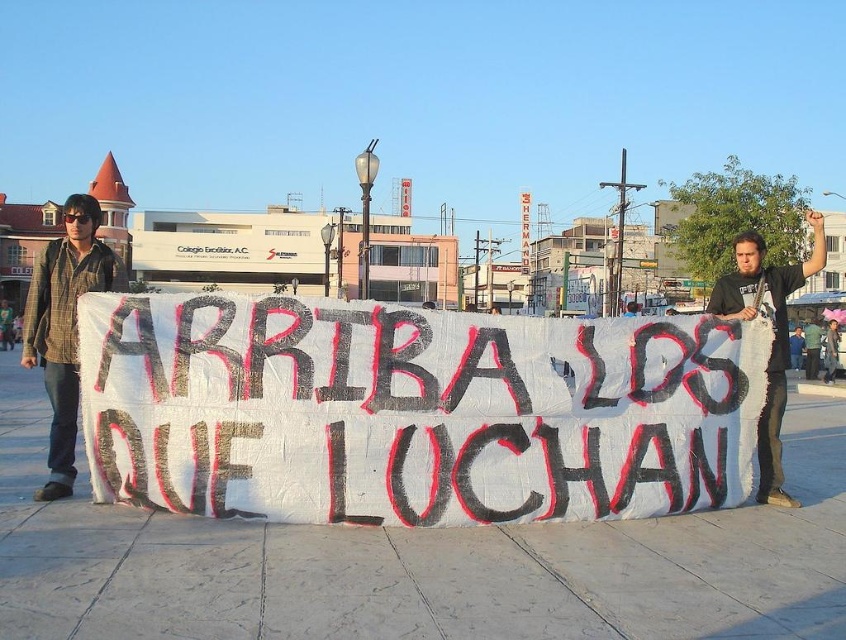
Is white paper banner at center further to camera compared to black t-shirt at center?

No, it is in front of black t-shirt at center.

Which is in front, point (531, 508) or point (744, 296)?

Point (531, 508) is in front.

Is point (578, 381) farther from viewer compared to point (794, 289)?

No.

Locate an element on the screen. white paper banner at center is located at coordinates (411, 412).

Who is lower down, white paper banner at center or plaid shirt at left?

white paper banner at center is below.

Who is taller, white paper banner at center or plaid shirt at left?

plaid shirt at left

Between point (323, 358) and point (118, 276), which one is positioned behind?

Point (118, 276)

Where is `white paper banner at center`? The height and width of the screenshot is (640, 846). white paper banner at center is located at coordinates (411, 412).

Does plaid shirt at left have a smaller size compared to green fabric shirt at center?

No, plaid shirt at left is not smaller than green fabric shirt at center.

Which is in front, point (37, 266) or point (805, 330)?

Point (37, 266) is in front.

Identify the location of plaid shirt at left. (64, 324).